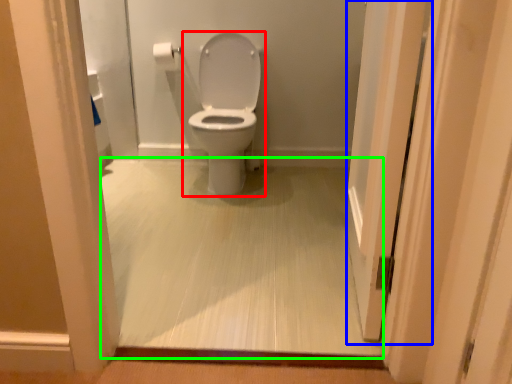
Question: Estimate the real-world distances between objects in this image. Which object is closer to toilet (highlighted by a red box), screen door (highlighted by a blue box) or corridor (highlighted by a green box)?

Choices:
 (A) screen door
 (B) corridor

Answer: (B)